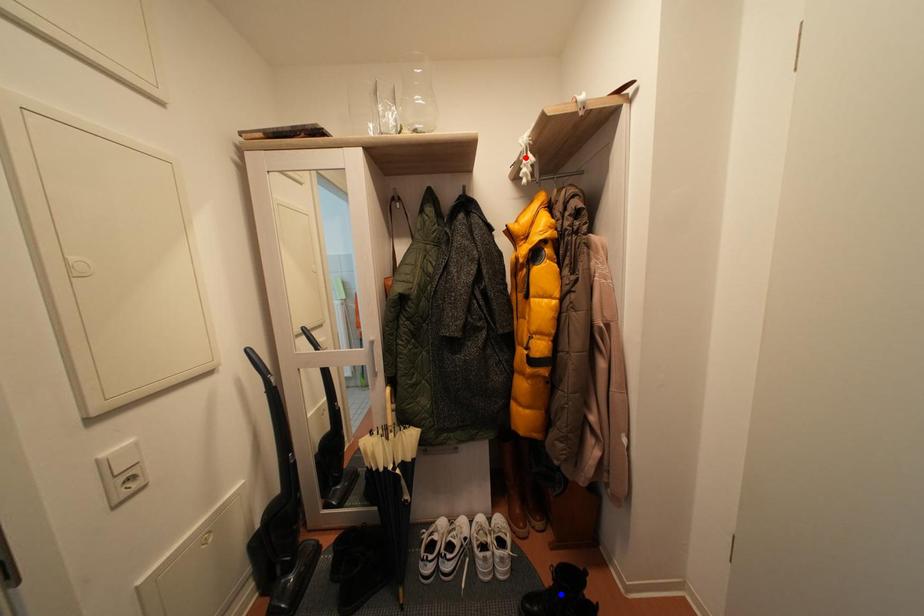
Question: In the image, two points are highlighted. Which point is nearer to the camera? Reply with the corresponding letter.

Choices:
 (A) blue point
 (B) red point

Answer: (A)